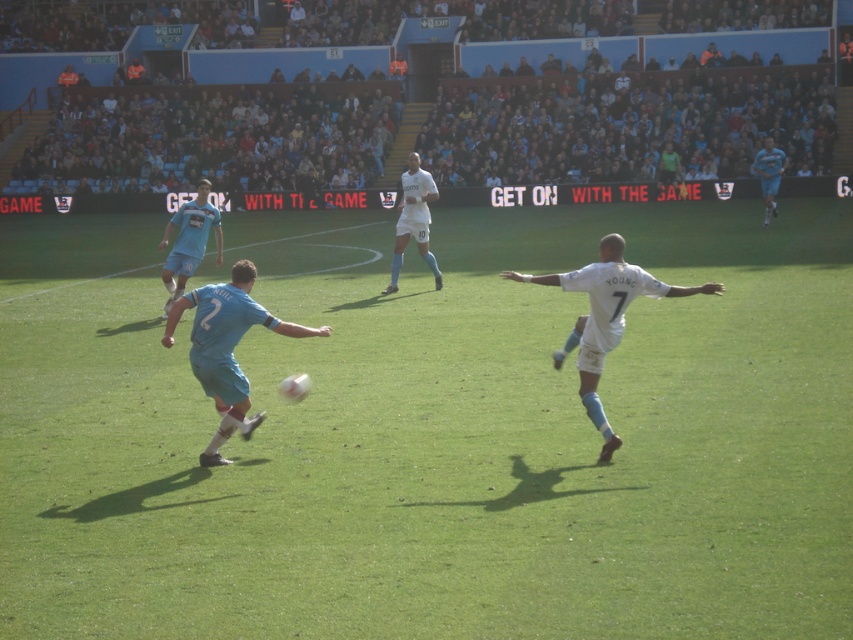
Question: Is green grass football field at center smaller than light blue jersey at center?

Choices:
 (A) yes
 (B) no

Answer: (B)

Question: Which object is positioned closest to the light blue jersey at upper right?

Choices:
 (A) matte blue jersey at center
 (B) white matte jersey at center
 (C) green grass football field at center
 (D) light blue jersey at center

Answer: (C)

Question: Can you confirm if matte blue jersey at center is positioned to the right of light blue jersey at center?

Choices:
 (A) yes
 (B) no

Answer: (A)

Question: Does matte blue jersey at center have a lesser width compared to white matte jersey at center?

Choices:
 (A) yes
 (B) no

Answer: (A)

Question: Estimate the real-world distances between objects in this image. Which object is farther from the white matte jersey at center?

Choices:
 (A) green grass football field at center
 (B) light blue jersey at upper right

Answer: (B)

Question: Which of the following is the farthest from the observer?

Choices:
 (A) (780, 176)
 (B) (503, 275)
 (C) (196, 186)

Answer: (C)